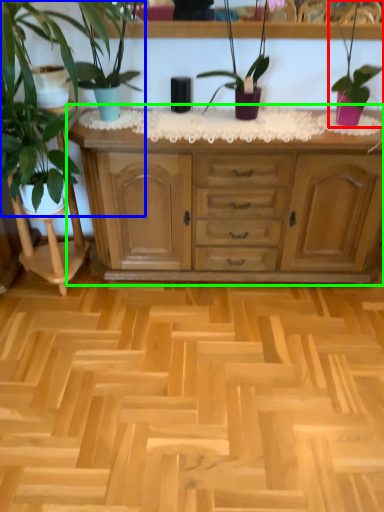
Question: Considering the real-world distances, which object is farthest from houseplant (highlighted by a red box)? houseplant (highlighted by a blue box) or chest of drawers (highlighted by a green box)?

Choices:
 (A) houseplant
 (B) chest of drawers

Answer: (A)